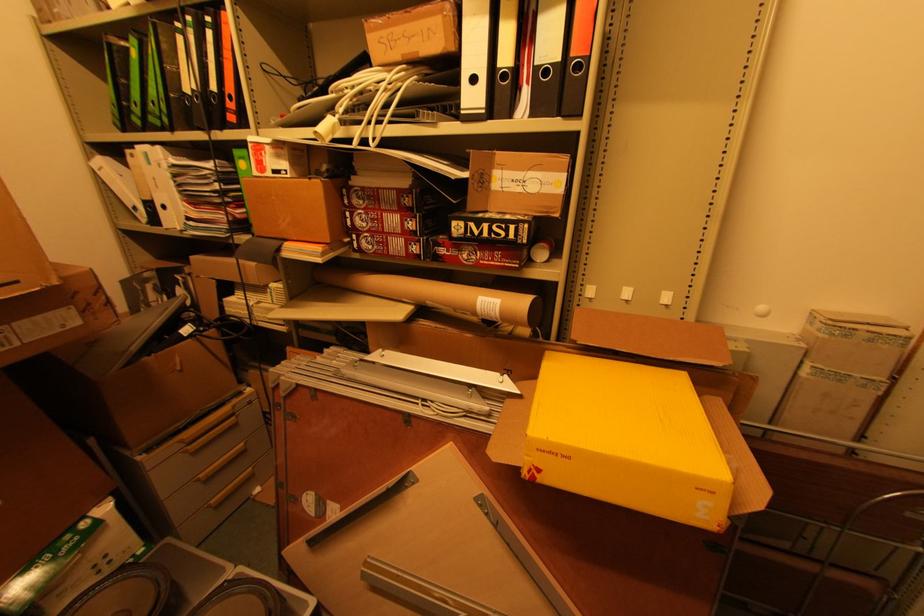
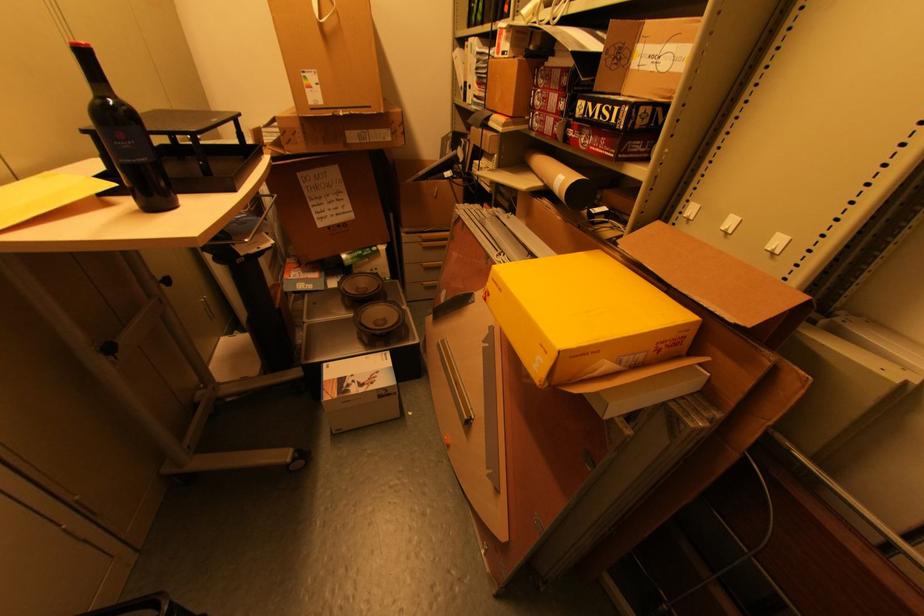
The point at (675, 360) is marked in the first image. Where is the corresponding point in the second image?

(688, 294)